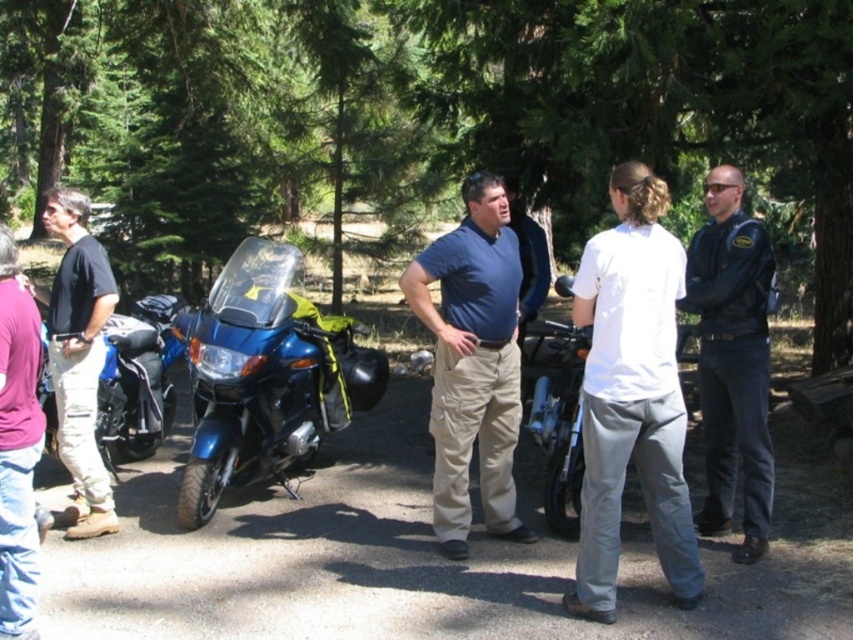
You are standing at the point with coordinates point [467,368] and want to walk to the point with coordinates point [605,328]. Which direction should you move relative to the other point?

You should move forward because point [605,328] is in front of point [467,368].

You are organizing a group photo and need to arrange two shirts on a display stand. The white cotton shirt at center and the blue cotton shirt at center must be placed side by side. Which shirt should you place on the left side to ensure they fit within the stand that can only accommodate the larger of the two shirts?

You should place the blue cotton shirt at center on the left side because it is larger than the white cotton shirt at center, so it will fit within the stand designed for the larger shirt.